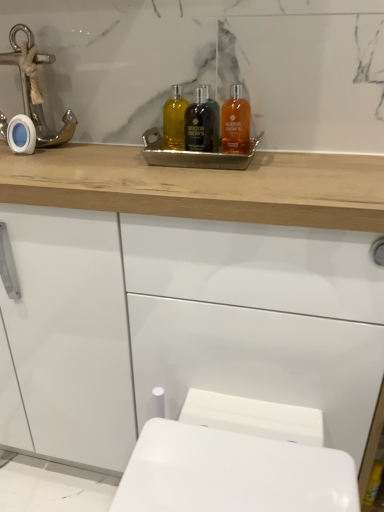
Question: Should I look upward or downward to see black glass bottle at center, arranged as the 2th mouthwash when viewed from the left?

Choices:
 (A) down
 (B) up

Answer: (B)

Question: In which direction should I rotate to look at translucent amber liquid at upper center, the 1th mouthwash when ordered from right to left?

Choices:
 (A) left
 (B) right

Answer: (B)

Question: From a real-world perspective, is black glass bottle at center, arranged as the 2th mouthwash when viewed from the left, over translucent amber liquid at center, marked as the 3th mouthwash in a right-to-left arrangement?

Choices:
 (A) yes
 (B) no

Answer: (A)

Question: Considering the relative sizes of black glass bottle at center, arranged as the 2th mouthwash when viewed from the left, and translucent amber liquid at center, the 1th mouthwash positioned from the left, in the image provided, is black glass bottle at center, arranged as the 2th mouthwash when viewed from the left, wider than translucent amber liquid at center, the 1th mouthwash positioned from the left,?

Choices:
 (A) no
 (B) yes

Answer: (A)

Question: Is black glass bottle at center, arranged as the 2th mouthwash when viewed from the left, turned away from translucent amber liquid at center, the 1th mouthwash positioned from the left?

Choices:
 (A) yes
 (B) no

Answer: (B)

Question: From the image's perspective, would you say black glass bottle at center, arranged as the 2th mouthwash when viewed from the left, is shown under translucent amber liquid at center, the 1th mouthwash positioned from the left?

Choices:
 (A) no
 (B) yes

Answer: (B)

Question: Is black glass bottle at center, the 2th mouthwash from the right, positioned behind translucent amber liquid at center, marked as the 3th mouthwash in a right-to-left arrangement?

Choices:
 (A) yes
 (B) no

Answer: (A)

Question: Are black glass bottle at center, arranged as the 2th mouthwash when viewed from the left, and translucent amber liquid at center, marked as the 3th mouthwash in a right-to-left arrangement, far apart?

Choices:
 (A) yes
 (B) no

Answer: (B)

Question: Is black glass bottle at center, arranged as the 2th mouthwash when viewed from the left, to the left of white glossy cabinet at upper center from the viewer's perspective?

Choices:
 (A) yes
 (B) no

Answer: (B)

Question: From a real-world perspective, is black glass bottle at center, the 2th mouthwash from the right, located beneath white glossy cabinet at upper center?

Choices:
 (A) no
 (B) yes

Answer: (A)

Question: From a real-world perspective, is black glass bottle at center, arranged as the 2th mouthwash when viewed from the left, on top of white glossy cabinet at upper center?

Choices:
 (A) yes
 (B) no

Answer: (A)

Question: Could you tell me if black glass bottle at center, the 2th mouthwash from the right, is facing white glossy cabinet at upper center?

Choices:
 (A) no
 (B) yes

Answer: (A)

Question: Is black glass bottle at center, arranged as the 2th mouthwash when viewed from the left, outside of white glossy cabinet at upper center?

Choices:
 (A) yes
 (B) no

Answer: (A)

Question: Is black glass bottle at center, arranged as the 2th mouthwash when viewed from the left, taller than white glossy cabinet at upper center?

Choices:
 (A) no
 (B) yes

Answer: (A)

Question: From a real-world perspective, does white glossy porcelain at lower center sit lower than translucent amber liquid at upper center, the third mouthwash viewed from the left?

Choices:
 (A) no
 (B) yes

Answer: (B)